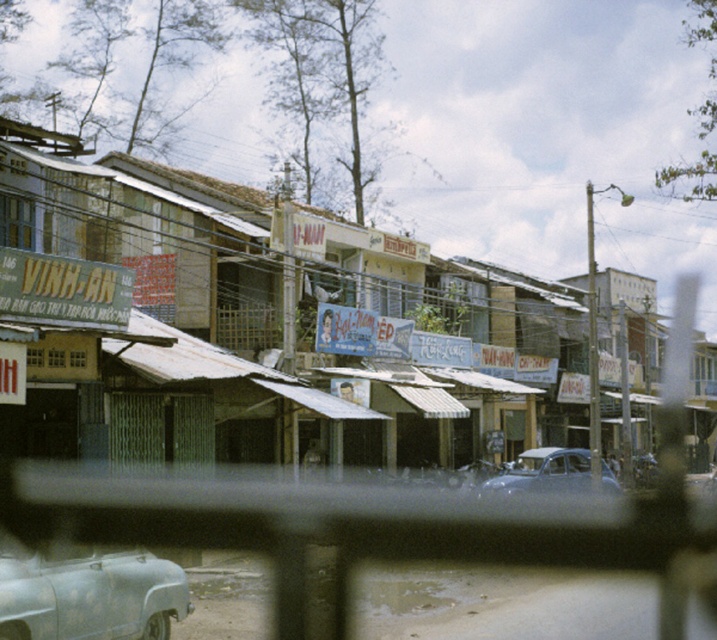
Consider the image. You are a delivery person who needs to read the text on the rusty metal signboard at center. Can you read it clearly from your current position?

The rusty metal signboard at center is 37.67 feet from the camera, so you cannot read it clearly from your current position.

You are a photographer standing behind a railing in a small town. You want to capture both the rusty metallic car at lower left and the matte gray car at center in a single photo. Which car should you move closer to in order to include both cars fully in your shot?

The rusty metallic car at lower left is thinner than the matte gray car at center. To include both cars fully in the shot, you should move closer to the matte gray car at center since it is wider and requires more space in the frame.

You are a photographer standing behind a railing in a small town. You see the rusty metallic car at lower left and the matte gray car at center. Which car is positioned higher in the image?

The rusty metallic car at lower left is located above the matte gray car at center, so it is positioned higher in the image.